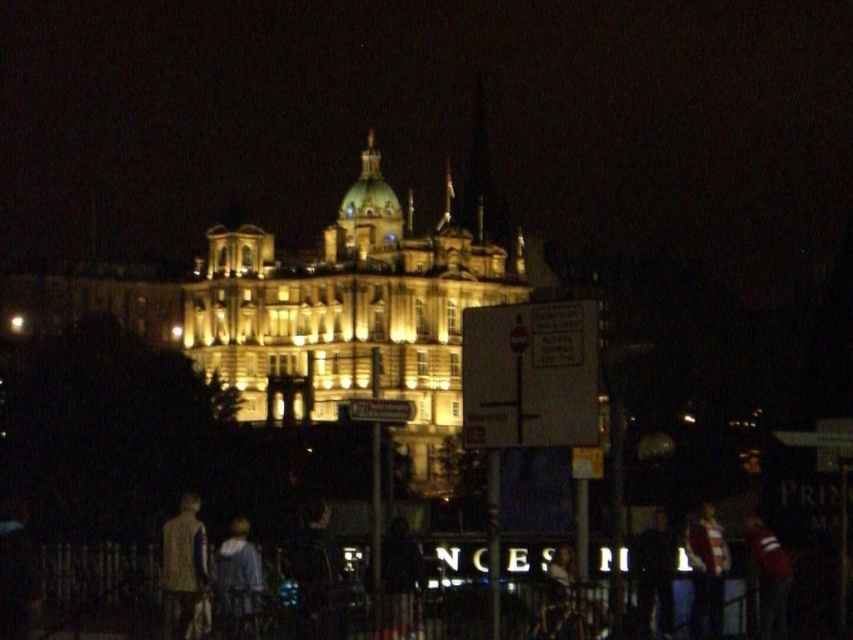
You are a photographer trying to capture the people in front of the illuminated building. You want to ensure both the light brown fabric jacket at lower left and the light blue fabric shirt at center are visible in your shot. Based on their positions, which person is positioned further to the left side of the frame?

The light brown fabric jacket at lower left is positioned to the left of the light blue fabric shirt at center, so the person wearing the light brown fabric jacket at lower left is further to the left in the frame.

You are a pedestrian standing in the foreground of the scene. You see a light brown fabric jacket at lower left and a striped jersey at lower right. Which clothing item is positioned higher from the ground?

The light brown fabric jacket at lower left is above the striped jersey at lower right, so it is positioned higher from the ground.

You are standing in front of the illuminated building and see two people wearing a light brown fabric jacket at lower left and a light blue fabric shirt at center. Which person is closer to you?

The light brown fabric jacket at lower left is closer to you because it is further to the viewer than the light blue fabric shirt at center.